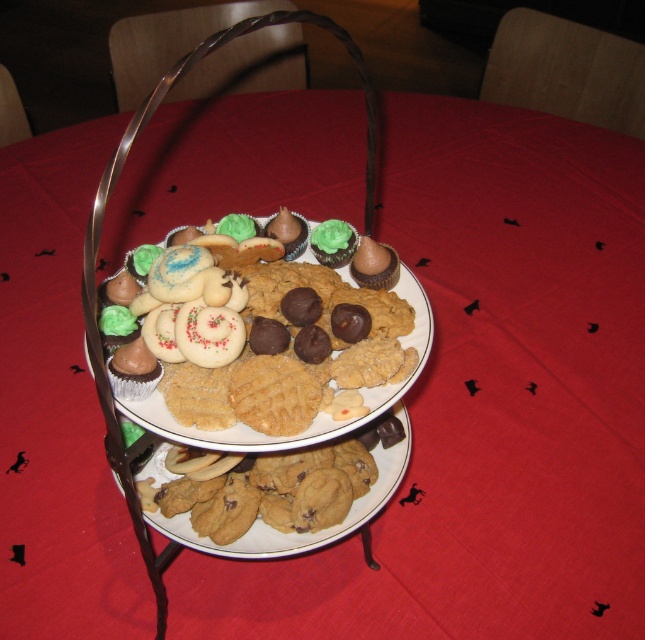
You are a baker who needs to place a new cookie on the exact center of the top tier of the serving tray. The tray has a coordinate system where the bottom left corner is the origin. Where should you place the new cookie to match the position of the matte chocolate cookie at center?

The matte chocolate cookie at center is located at coordinates point (266,355), so you should place the new cookie at the same coordinates to match its position.

You are standing in front of the table with the two tiered serving tray. You want to place a new cookie on the tray. The tray has two points marked at coordinates point (317, 378) and point (404, 380). Which point is closer to you where you can place the cookie?

Point (317, 378) is closer to the camera than point (404, 380), so you should place the cookie at point (317, 378) since it is closer to you.